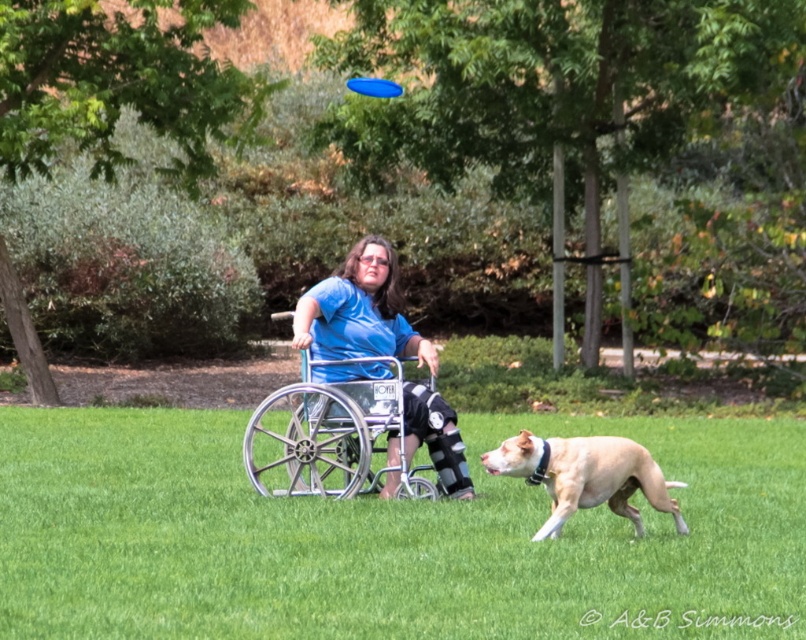
Based on the photo, who is positioned more to the right, green grass at center or silver metallic wheelchair at center?

From the viewer's perspective, green grass at center appears more on the right side.

Between green grass at center and silver metallic wheelchair at center, which one has less height?

Standing shorter between the two is green grass at center.

Is point (100, 508) closer to viewer compared to point (337, 454)?

Yes, it is.

The height and width of the screenshot is (640, 806). Identify the location of green grass at center. (385, 538).

Who is lower down, green grass at center or tan smooth fur at center?

green grass at center is lower down.

What do you see at coordinates (385, 538) in the screenshot? I see `green grass at center` at bounding box center [385, 538].

Between point (143, 412) and point (593, 444), which one is positioned in front?

Positioned in front is point (593, 444).

This screenshot has height=640, width=806. In order to click on green grass at center in this screenshot , I will do `click(385, 538)`.

Which is more to the right, tan smooth fur at center or blue plastic frisbee at upper center?

tan smooth fur at center

Does point (667, 499) come in front of point (350, 86)?

Yes, it is in front of point (350, 86).

You are a GUI agent. You are given a task and a screenshot of the screen. Output one action in this format:
    pyautogui.click(x=<x>, y=<y>)
    Task: Click on the tan smooth fur at center
    The image size is (806, 640).
    Given the screenshot: What is the action you would take?
    pyautogui.click(x=584, y=476)